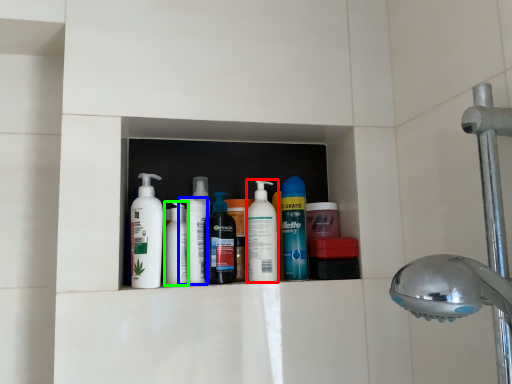
Question: Based on their relative distances, which object is nearer to cleaning product (highlighted by a red box)? Choose from cleaning product (highlighted by a blue box) and toiletry (highlighted by a green box).

Choices:
 (A) cleaning product
 (B) toiletry

Answer: (A)